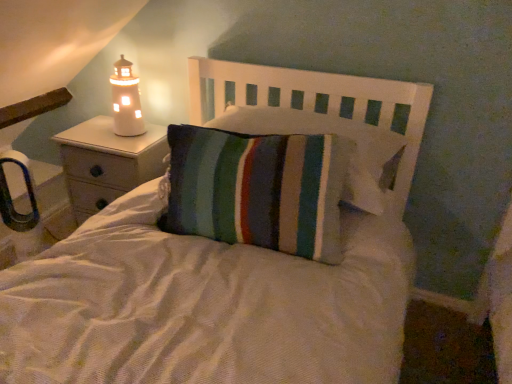
At what (x,y) coordinates should I click in order to perform the action: click on free location in front of white ceramic lighthouse at left. Please return your answer as a coordinate pair (x, y). This screenshot has width=512, height=384. Looking at the image, I should click on (120, 149).